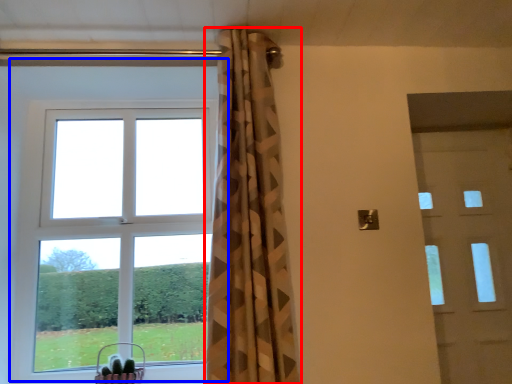
Question: Which object appears closest to the camera in this image, curtain (highlighted by a red box) or window (highlighted by a blue box)?

Choices:
 (A) curtain
 (B) window

Answer: (A)